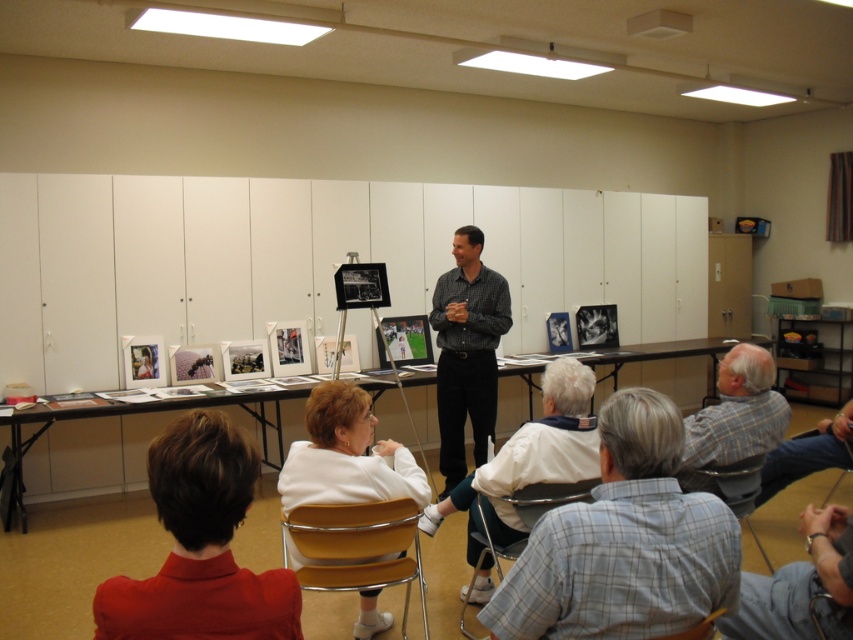
Based on the photo, does plaid shirt at lower right have a lesser height compared to smooth red shirt at lower left?

No, plaid shirt at lower right is not shorter than smooth red shirt at lower left.

Is plaid shirt at lower right above smooth red shirt at lower left?

Incorrect, plaid shirt at lower right is not positioned above smooth red shirt at lower left.

Locate an element on the screen. plaid shirt at lower right is located at coordinates pyautogui.click(x=624, y=541).

Image resolution: width=853 pixels, height=640 pixels. I want to click on plaid shirt at lower right, so click(x=624, y=541).

Which of these two, white shirt at center or metallic silver chair at lower center, stands taller?

Standing taller between the two is white shirt at center.

Which is more to the right, white shirt at center or metallic silver chair at lower center?

From the viewer's perspective, white shirt at center appears more on the right side.

Who is more forward, (485, 602) or (560, 500)?

Point (560, 500) is more forward.

Where is `white shirt at center`? white shirt at center is located at coordinates (529, 458).

Which of these two, plaid shirt at lower right or white shirt at center, stands taller?

With more height is white shirt at center.

Which of these two, plaid shirt at lower right or white shirt at center, stands shorter?

Standing shorter between the two is plaid shirt at lower right.

This screenshot has height=640, width=853. Identify the location of plaid shirt at lower right. (624, 541).